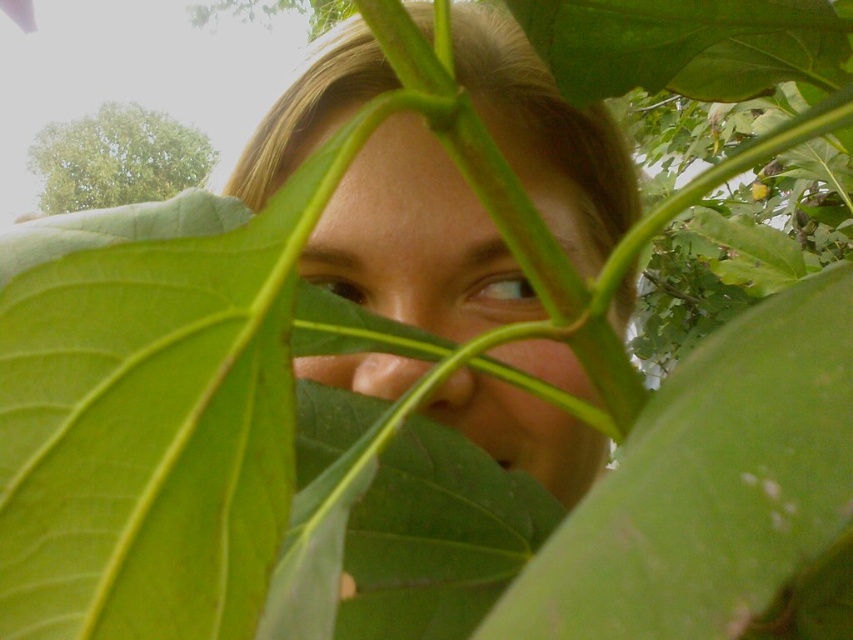
From the picture: Does green matte leaf at upper center appear over light brown eye at upper center?

Correct, green matte leaf at upper center is located above light brown eye at upper center.

Between green matte leaf at upper center and light brown eye at upper center, which one appears on the left side from the viewer's perspective?

light brown eye at upper center

Identify the location of green matte leaf at upper center. The image size is (853, 640). click(685, 45).

Which is below, smooth skin face at center or green leafy tree at upper left?

Positioned lower is smooth skin face at center.

Locate an element on the screen. The width and height of the screenshot is (853, 640). smooth skin face at center is located at coordinates (410, 234).

Which is in front, point (438, 403) or point (161, 177)?

Point (438, 403)

I want to click on smooth skin face at center, so click(x=410, y=234).

Between green leafy tree at upper left and light brown eye at upper center, which one is positioned higher?

Positioned higher is green leafy tree at upper left.

Locate an element on the screen. The width and height of the screenshot is (853, 640). green leafy tree at upper left is located at coordinates (115, 157).